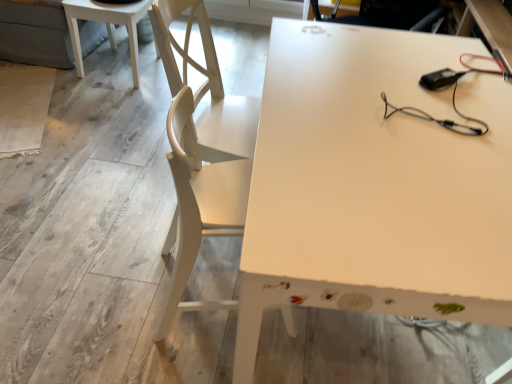
The width and height of the screenshot is (512, 384). What are the coordinates of `free region under white glossy table at upper left, placed as the second table when sorted from front to back (from a real-world perspective)` in the screenshot? It's located at (137, 59).